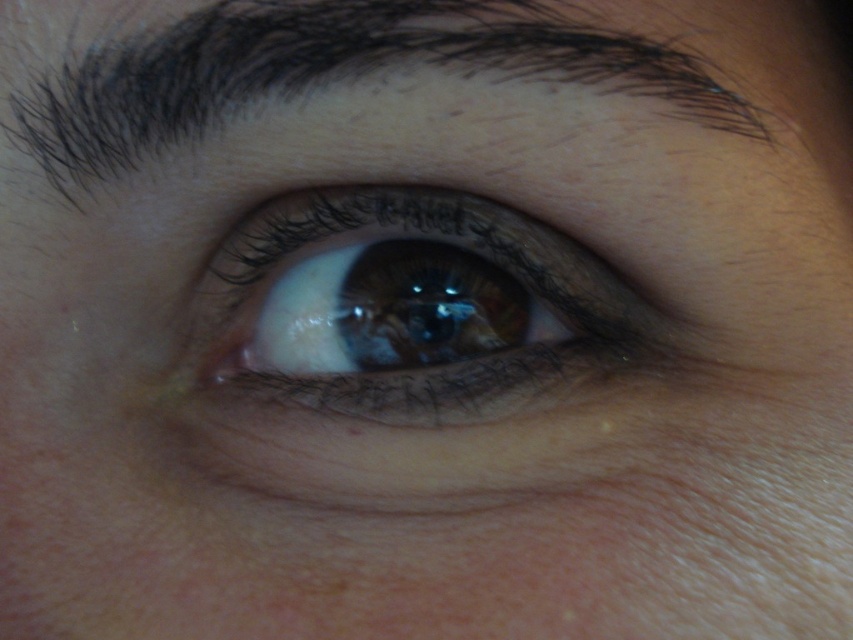
You are a makeup artist preparing to apply eyeliner to the brown matte eye at center and the dark brown hair at upper center. Which object is located to the right of the other?

The brown matte eye at center is positioned on the right side of dark brown hair at upper center, so the brown matte eye at center is to the right of the dark brown hair at upper center.

You are a makeup artist preparing to apply eyeliner to the brown matte eye at center. You notice dark brown hair at upper center nearby. Considering their relative heights in the image, which object is positioned higher from the ground?

The dark brown hair at upper center is positioned higher from the ground than the brown matte eye at center because the brown matte eye at center is much shorter than dark brown hair at upper center.